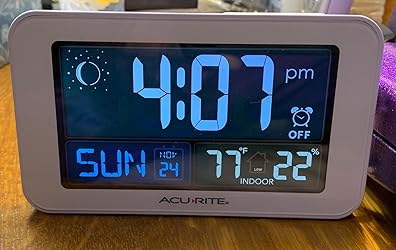
At what (x,y) coordinates should I click in order to perform the action: click on wall. Please return your answer as a coordinate pair (x, y). Image resolution: width=396 pixels, height=250 pixels. Looking at the image, I should click on (10, 13).